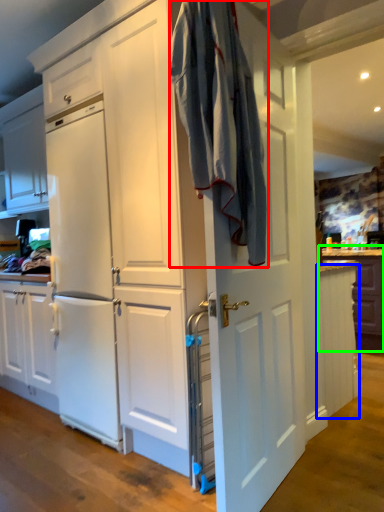
Question: Considering the real-world distances, which object is closest to laundry (highlighted by a red box)? cabinetry (highlighted by a blue box) or counter (highlighted by a green box).

Choices:
 (A) cabinetry
 (B) counter

Answer: (A)